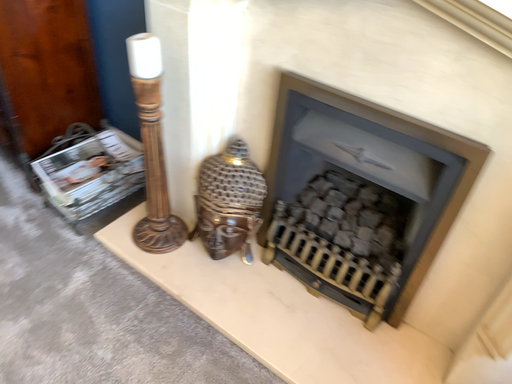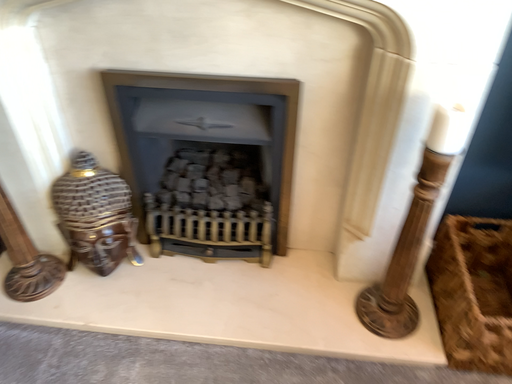
Question: Which way did the camera rotate in the video?

Choices:
 (A) rotated right
 (B) rotated left

Answer: (A)